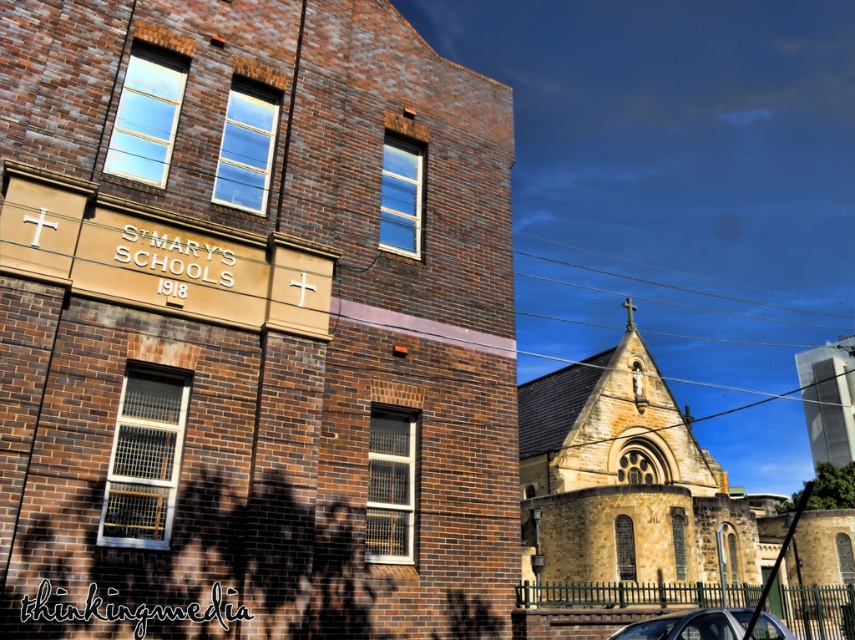
You are a photographer wanting to capture both the brown stone church at center and the metallic silver car at lower right in a single frame. Which object should you focus on first to ensure both are in the frame?

The brown stone church at center is taller than the metallic silver car at lower right, so you should focus on the brown stone church at center first to ensure both are in the frame.

You are driving a metallic silver car at lower right and want to park it in front of the brown stone church at center. Is there enough space between the church and the road to park the car?

The brown stone church at center is to the left of the metallic silver car at lower right, so there is space between them for parking.

From the picture: You are a delivery person with a cart that is 2 meters wide. You need to deliver packages between the brown stone church at center and the yellow stone church at center. Can your cart fit through the space between them?

The brown stone church at center and the yellow stone church at center are 20.79 meters apart from each other. Since your cart is only 2 meters wide, it can easily fit through the space between them as the distance between the two churches is much larger than the cart width.